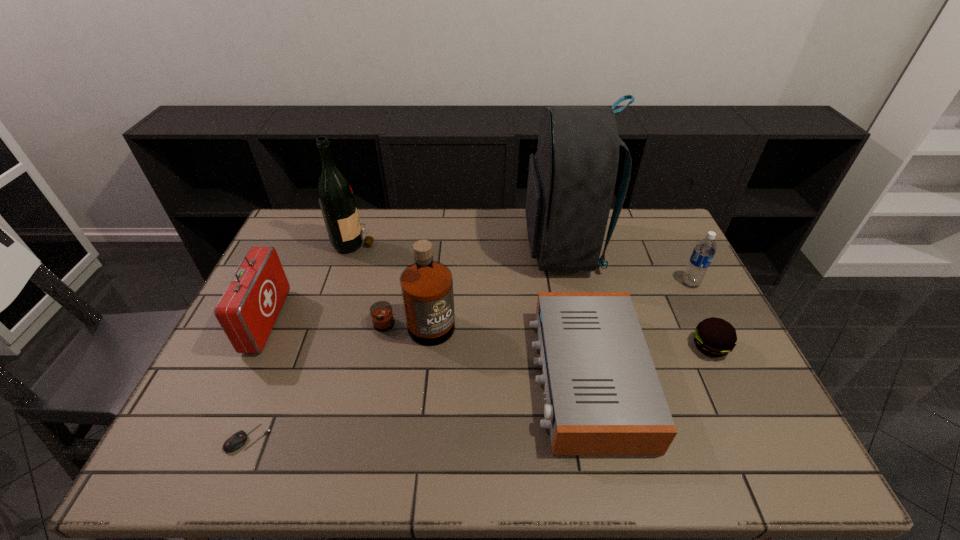
Where is `free space at the far edge of the desktop`? This screenshot has width=960, height=540. free space at the far edge of the desktop is located at coordinates (521, 229).

I want to click on vacant area at the near edge of the desktop, so click(x=644, y=458).

Identify the location of vacant area at the right edge of the desktop. (687, 296).

In the image, there is a desktop. Where is `vacant space at the far left corner`? This screenshot has width=960, height=540. vacant space at the far left corner is located at coordinates (294, 246).

Where is `vacant space at the far right corner of the desktop`? Image resolution: width=960 pixels, height=540 pixels. vacant space at the far right corner of the desktop is located at coordinates (640, 230).

The width and height of the screenshot is (960, 540). I want to click on free space between the shortest object and the backpack, so click(x=406, y=343).

You are a GUI agent. You are given a task and a screenshot of the screen. Output one action in this format:
    pyautogui.click(x=<x>, y=<y>)
    Task: Click on the free space between the water bottle and the leftmost object
    This screenshot has width=960, height=540.
    Given the screenshot: What is the action you would take?
    pyautogui.click(x=479, y=302)

The image size is (960, 540). Find the location of `vacant space that's between the third tallest object and the backpack`. vacant space that's between the third tallest object and the backpack is located at coordinates (489, 288).

This screenshot has height=540, width=960. What are the coordinates of `vacant point located between the seventh tallest object and the seventh shortest object` in the screenshot? It's located at (532, 294).

You are a GUI agent. You are given a task and a screenshot of the screen. Output one action in this format:
    pyautogui.click(x=<x>, y=<y>)
    Task: Click on the vacant space in between the third tallest object and the third shortest object
    This screenshot has width=960, height=540.
    Given the screenshot: What is the action you would take?
    pyautogui.click(x=500, y=352)